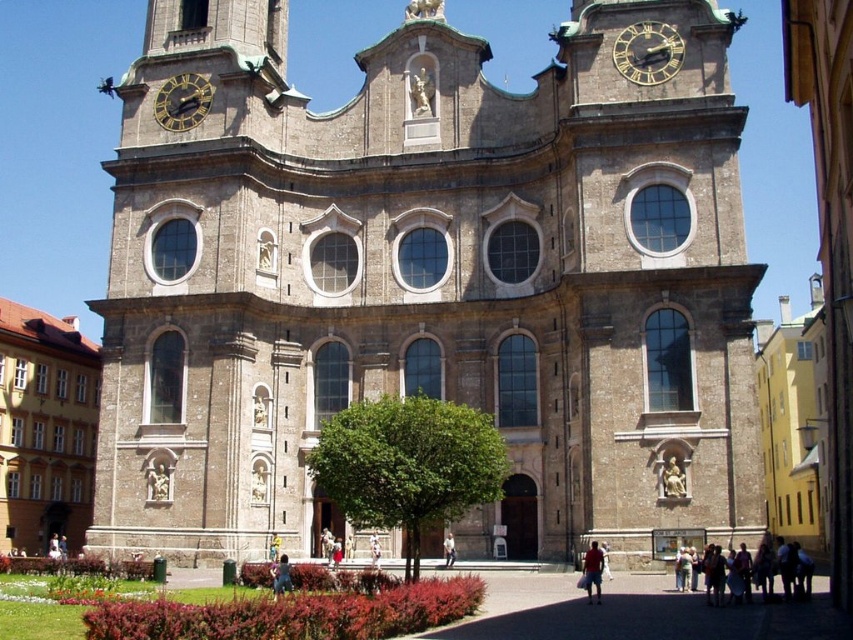
From the picture: Does dark blue jeans at center have a smaller size compared to white cotton shirt at center?

Yes.

Find the location of a particular element. This screenshot has width=853, height=640. dark blue jeans at center is located at coordinates (282, 577).

Does point (276, 570) come closer to viewer compared to point (444, 556)?

That is True.

The width and height of the screenshot is (853, 640). Identify the location of dark blue jeans at center. (282, 577).

Is brown stone church at left to the left of white cotton shirt at center from the viewer's perspective?

Correct, you'll find brown stone church at left to the left of white cotton shirt at center.

Between brown stone church at left and white cotton shirt at center, which one is positioned higher?

brown stone church at left is higher up.

In order to click on brown stone church at left in this screenshot , I will do `click(45, 428)`.

Is brown stone tower at upper center below gold metallic clock at upper center?

Yes.

Is brown stone tower at upper center positioned at the back of gold metallic clock at upper center?

No, it is in front of gold metallic clock at upper center.

Find the location of `brown stone tower at upper center`. brown stone tower at upper center is located at coordinates (428, 284).